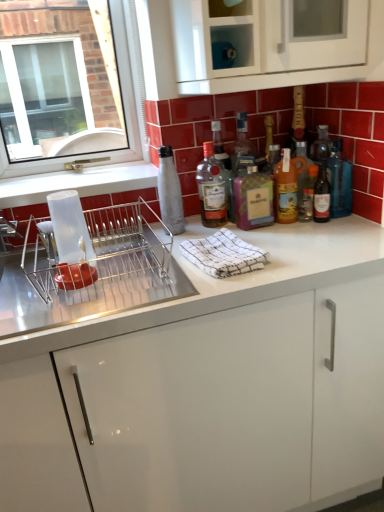
Find the location of a particular element. The width and height of the screenshot is (384, 512). free space that is to the left of white glass bottle at center, which is the first bottle in left-to-right order is located at coordinates (132, 236).